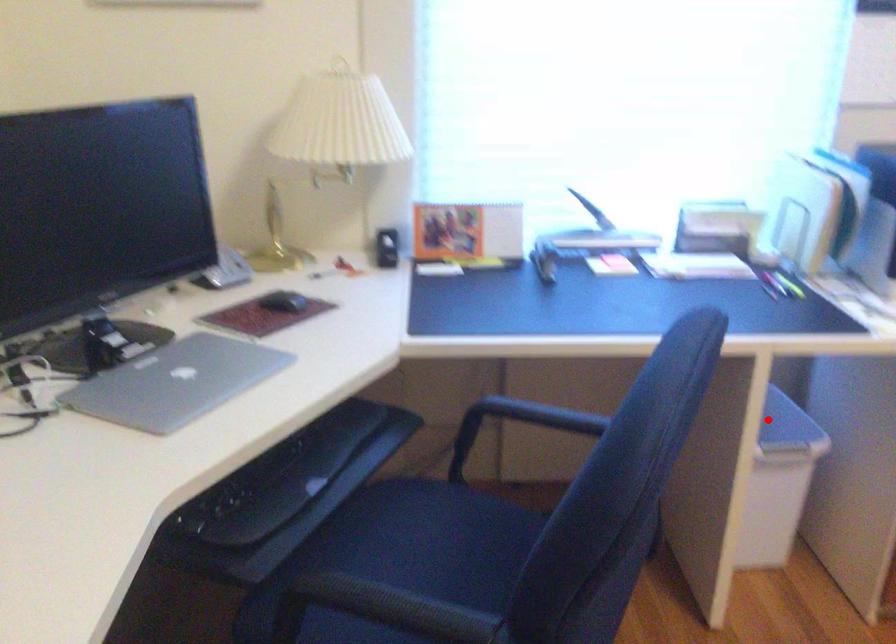
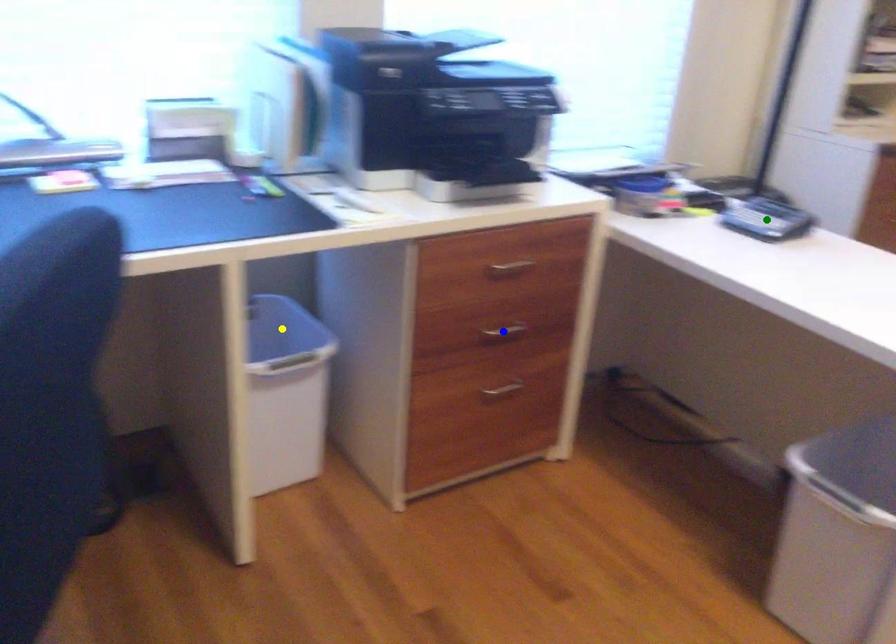
Question: I am providing you with two images of the same scene from different viewpoints. A red point is marked on the first image. You are given multiple points on the second image. Which mark in image 2 goes with the point in image 1?

Choices:
 (A) green point
 (B) yellow point
 (C) blue point

Answer: (B)